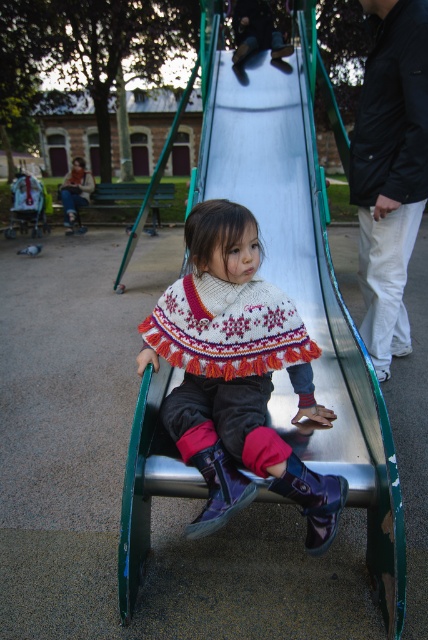
Is metallic silver slide at center bigger than knitted wool poncho at center?

Yes.

Does point (394, 577) lie in front of point (208, 212)?

Yes.

This screenshot has height=640, width=428. What are the coordinates of `metallic silver slide at center` in the screenshot? It's located at (306, 289).

Does point (333, 352) come farther from viewer compared to point (368, 65)?

No, it is in front of (368, 65).

Who is higher up, metallic silver slide at center or black cotton sweater at upper right?

metallic silver slide at center is above.

The width and height of the screenshot is (428, 640). Find the location of `metallic silver slide at center`. metallic silver slide at center is located at coordinates (306, 289).

Where is `metallic silver slide at center`? metallic silver slide at center is located at coordinates (306, 289).

Between knitted wool poncho at center and black cotton sweater at upper right, which one appears on the left side from the viewer's perspective?

knitted wool poncho at center is more to the left.

Is knitted wool poncho at center to the right of black cotton sweater at upper right from the viewer's perspective?

No, knitted wool poncho at center is not to the right of black cotton sweater at upper right.

Identify the location of knitted wool poncho at center. Image resolution: width=428 pixels, height=640 pixels. (237, 372).